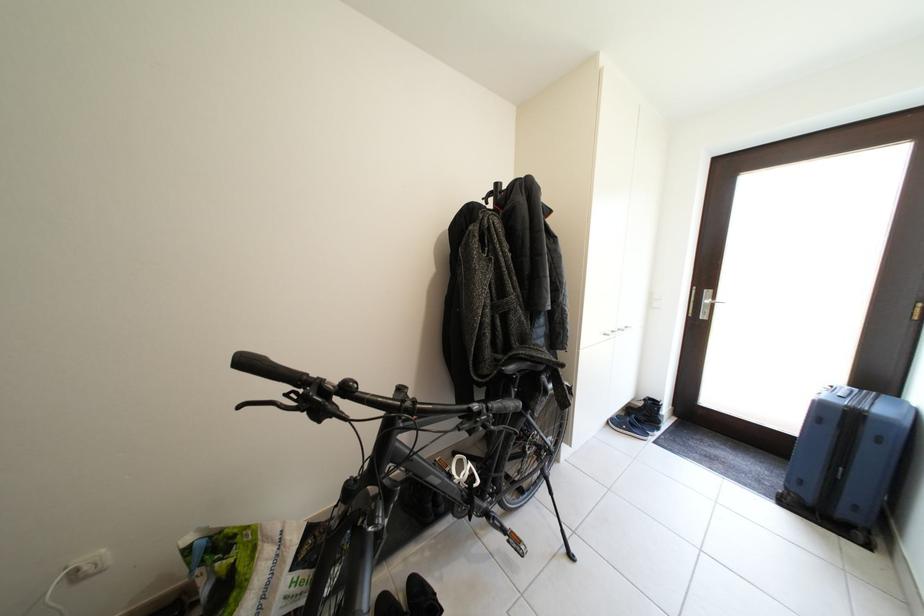
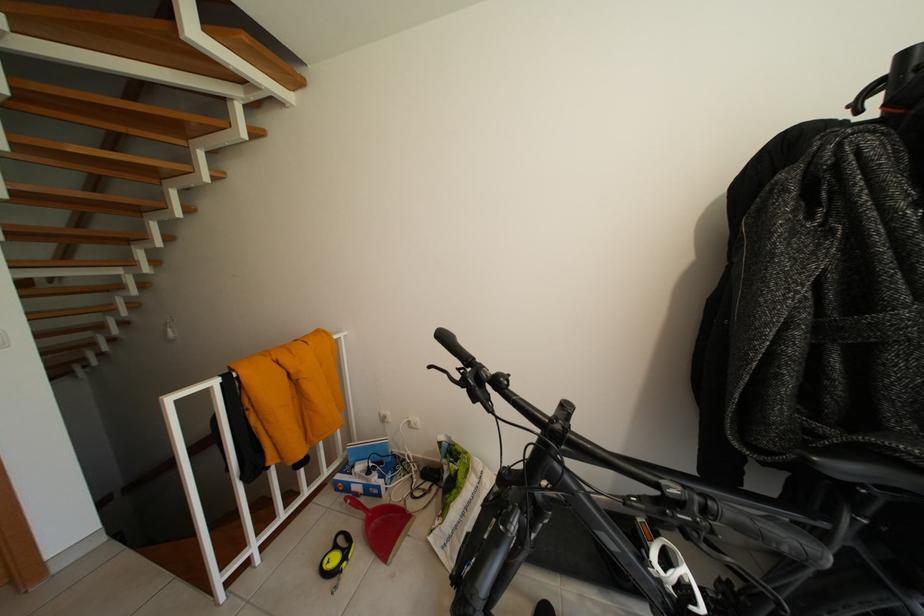
Question: The camera is either moving clockwise (left) or counter-clockwise (right) around the object. The first image is from the beginning of the video and the second image is from the end. Is the camera moving left or right when shooting the video?

Choices:
 (A) Left
 (B) Right

Answer: (B)